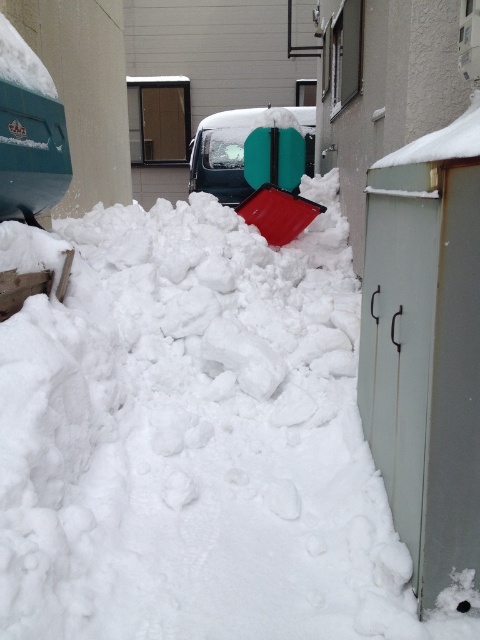
Question: Which is nearer to the white fluffy snow at center?

Choices:
 (A) green plastic shovel at center
 (B) green matte van at center

Answer: (A)

Question: Estimate the real-world distances between objects in this image. Which object is farther from the green plastic shovel at center?

Choices:
 (A) green matte van at center
 (B) white fluffy snow at center

Answer: (B)

Question: Does white fluffy snow at center appear over green plastic shovel at center?

Choices:
 (A) yes
 (B) no

Answer: (B)

Question: Which point is farther to the camera?

Choices:
 (A) green matte van at center
 (B) green plastic shovel at center
 (C) white fluffy snow at center

Answer: (A)

Question: Is white fluffy snow at center further to the viewer compared to green plastic shovel at center?

Choices:
 (A) no
 (B) yes

Answer: (A)

Question: Is green plastic shovel at center behind green matte van at center?

Choices:
 (A) yes
 (B) no

Answer: (B)